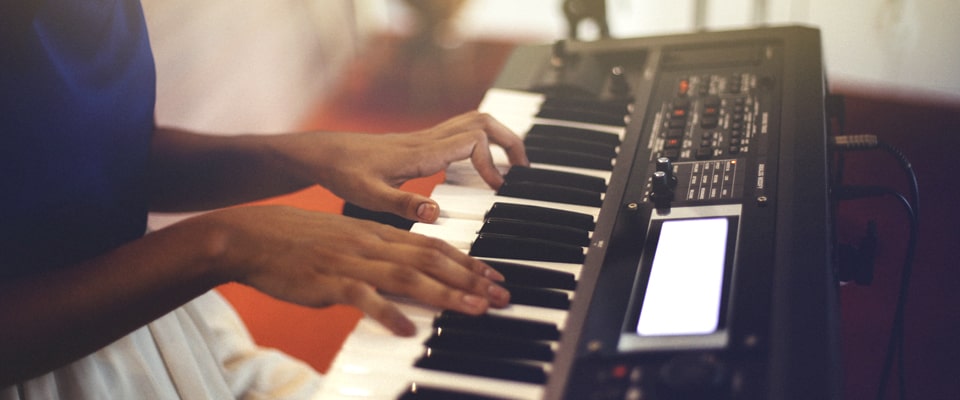
Where is `keyboard keys`? keyboard keys is located at coordinates (515, 99), (584, 105), (572, 130), (557, 213), (539, 249), (529, 304), (509, 366), (348, 381), (372, 349).